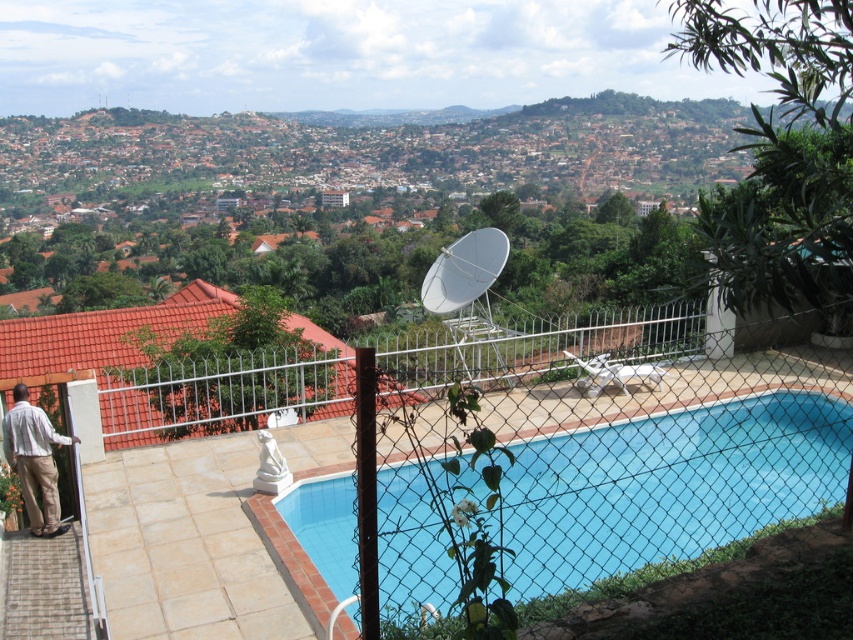
Question: Can you confirm if blue smooth pool at center is positioned to the right of light brown cotton pants at lower left?

Choices:
 (A) no
 (B) yes

Answer: (B)

Question: Which of these objects is positioned closest to the white metal fence at center?

Choices:
 (A) blue smooth pool at center
 (B) light brown cotton pants at lower left

Answer: (A)

Question: In this image, where is white metal fence at center located relative to light brown cotton pants at lower left?

Choices:
 (A) below
 (B) above

Answer: (B)

Question: Does blue smooth pool at center have a larger size compared to white metal fence at center?

Choices:
 (A) yes
 (B) no

Answer: (B)

Question: Based on their relative distances, which object is farther from the light brown cotton pants at lower left?

Choices:
 (A) blue smooth pool at center
 (B) white metal fence at center

Answer: (A)

Question: Estimate the real-world distances between objects in this image. Which object is closer to the blue smooth pool at center?

Choices:
 (A) white metal fence at center
 (B) light brown cotton pants at lower left

Answer: (A)